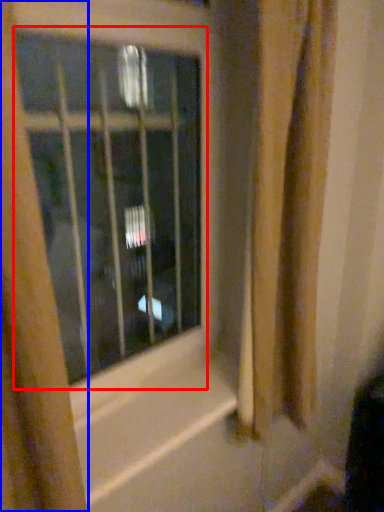
Question: Which of the following is the farthest to the observer, window (highlighted by a red box) or curtain (highlighted by a blue box)?

Choices:
 (A) window
 (B) curtain

Answer: (A)